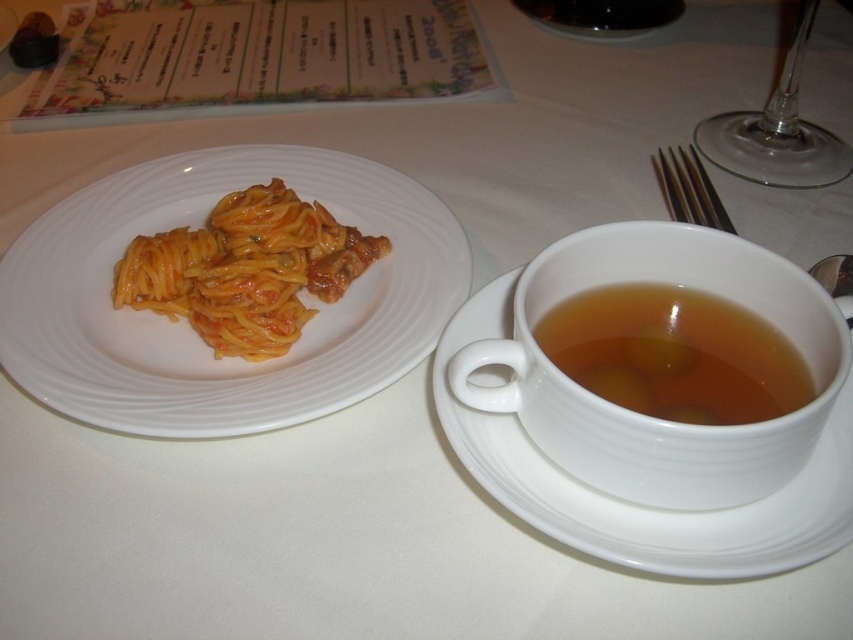
You are a photographer trying to capture a closeup of the pasta plate and the teacup. You notice two points marked on the image at coordinates point [851,518] and point [682,173]. Which point should you focus on to ensure the pasta plate is in sharp focus?

Point [851,518] is closer to the camera than point [682,173], so focusing on point [851,518] will ensure the pasta plate is in sharp focus.

Consider the image. You are setting up a table for a meal and need to place a decorative centerpiece. The current items on the table are the white ceramic plate at upper left. Where should you place the centerpiece to ensure it is centered on the table?

The white ceramic plate at upper left is located at point (x=187, y=323), so the centerpiece should be placed at the center of the table, which is typically at coordinates like (x=426, y=320), ensuring it is centered and not overlapping with the plate.

Looking at this image, you are looking at the table setting described. There are two points on the table labeled as point 1 and point 2. Point 1 is at coordinate (241,419) and point 2 is at (463,420). If you were to place a small napkin at each point, which point would have the napkin closer to you?

The napkin placed at point 1 at coordinate (241,419) would be closer to you because it is further to the camera than point 2 at (463,420).